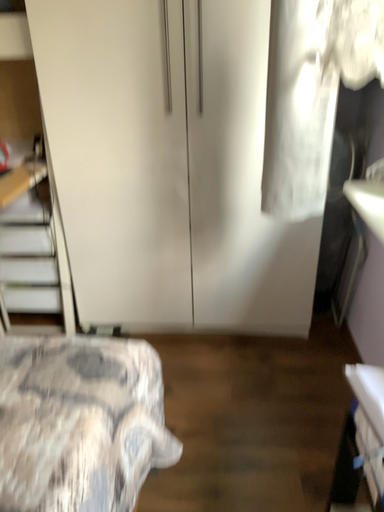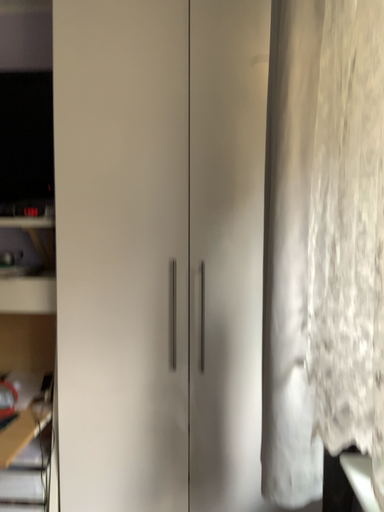
Question: Which way did the camera rotate in the video?

Choices:
 (A) rotated upward
 (B) rotated downward

Answer: (A)